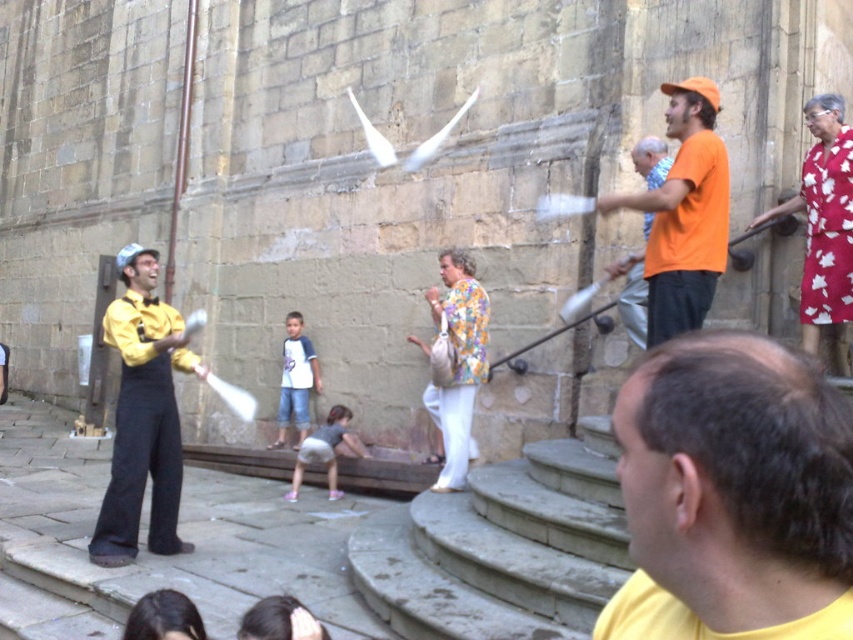
Question: Is yellow matte shirt at lower right above orange cotton shirt at right?

Choices:
 (A) no
 (B) yes

Answer: (A)

Question: Which object is the closest to the yellow matte shirt at lower right?

Choices:
 (A) yellow satin shirt at center
 (B) orange cotton shirt at right

Answer: (B)

Question: In this image, where is yellow matte shirt at lower right located relative to orange cotton shirt at right?

Choices:
 (A) left
 (B) right

Answer: (A)

Question: Which point is closer to the camera taking this photo?

Choices:
 (A) (666, 372)
 (B) (177, 490)
 (C) (686, 285)

Answer: (A)

Question: Based on their relative distances, which object is farther from the orange cotton shirt at right?

Choices:
 (A) yellow matte shirt at lower right
 (B) yellow satin shirt at center

Answer: (A)

Question: Does yellow matte shirt at lower right appear over orange cotton shirt at right?

Choices:
 (A) yes
 (B) no

Answer: (B)